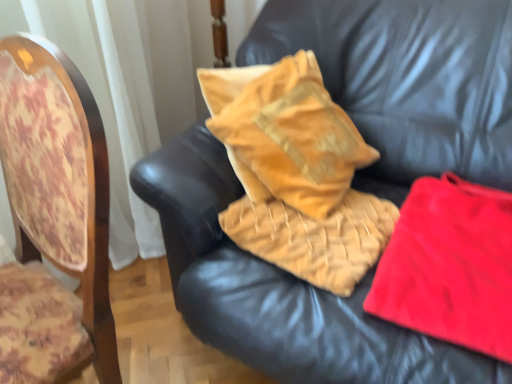
Question: Is point click(470, 362) closer or farther from the camera than point click(380, 236)?

Choices:
 (A) farther
 (B) closer

Answer: (B)

Question: Choose the correct answer: Is velvet orange pillow at upper center inside velvet gold pillow at center, the second material when ordered from right to left, or outside it?

Choices:
 (A) outside
 (B) inside

Answer: (A)

Question: Which is farther from the velvet/yellow pillow at center?

Choices:
 (A) wooden chair back at left
 (B) velvet orange pillow at upper center
 (C) velvet gold pillow at center, the second material when ordered from right to left
 (D) red fleece blanket at right, which is the 2th material from left to right

Answer: (A)

Question: Estimate the real-world distances between objects in this image. Which object is farther from the red fleece blanket at right, which is the 2th material from left to right?

Choices:
 (A) wooden chair back at left
 (B) velvet gold pillow at center, the second material when ordered from right to left
 (C) velvet orange pillow at upper center
 (D) velvet/yellow pillow at center

Answer: (A)